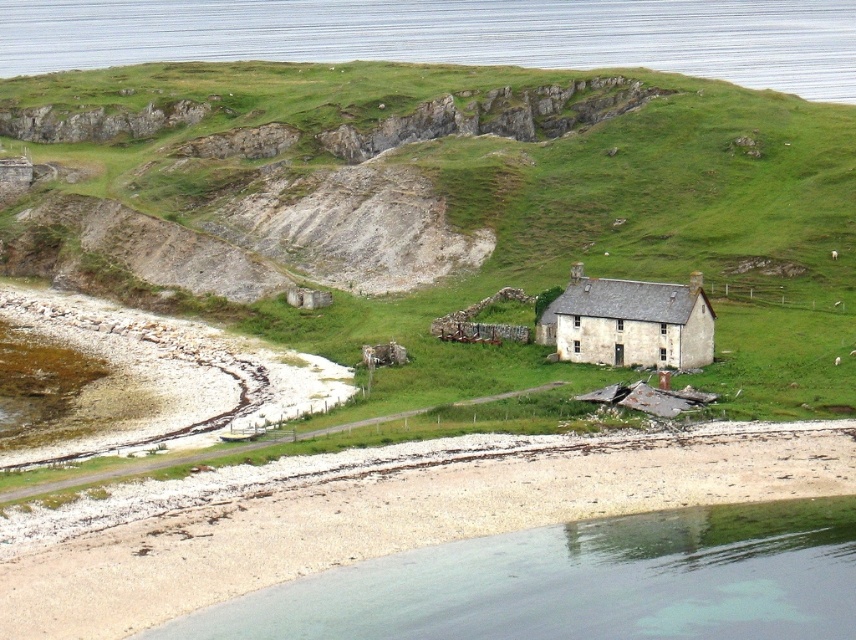
Is green grass at upper center to the right of weathered stone cottage at center from the viewer's perspective?

In fact, green grass at upper center is to the left of weathered stone cottage at center.

Can you confirm if green grass at upper center is shorter than weathered stone cottage at center?

No, green grass at upper center is not shorter than weathered stone cottage at center.

Is point (734, 29) positioned behind point (633, 296)?

Yes, it is behind point (633, 296).

At what (x,y) coordinates should I click in order to perform the action: click on green grass at upper center. Please return your answer as a coordinate pair (x, y). Looking at the image, I should click on (450, 35).

Between green grassy hillside at center and weathered stone cottage at center, which one is positioned lower?

weathered stone cottage at center is below.

Can you confirm if green grassy hillside at center is wider than weathered stone cottage at center?

Yes.

Identify the location of green grassy hillside at center. The height and width of the screenshot is (640, 856). point(452,196).

Is the position of smooth sand beach at lower left less distant than that of green grass at upper center?

Yes, it is in front of green grass at upper center.

Where is `smooth sand beach at lower left`? This screenshot has width=856, height=640. smooth sand beach at lower left is located at coordinates (373, 513).